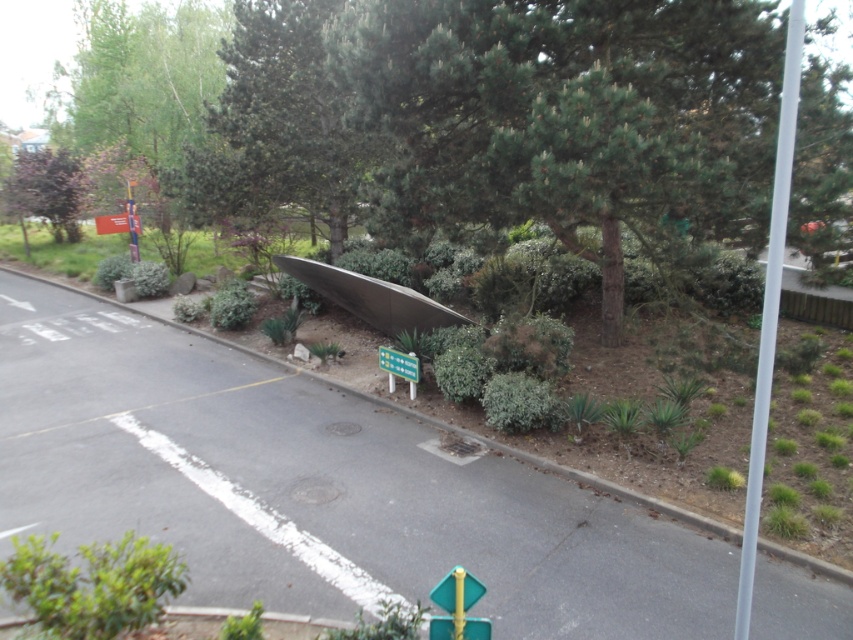
You are a city planner reviewing this street scene. The green textured tree at upper center is part of a proposed landscaping plan. Based on its position at coordinates point 0.195, 0.327, would it be positioned closer to the road or the center of the landscaped area?

The green textured tree at upper center is located at point [277,124], which places it closer to the road since it is positioned near the edge adjacent to the road in the landscaped area.

Looking at this image, you are a city planner reviewing the street layout. The green textured tree at upper center is crucial for shade. Can you confirm its exact coordinates to ensure it remains in the design plans?

The green textured tree at upper center is located at point (277, 124), so it should be included in the design plans at those coordinates.

You are a gardener planning to trim both the green textured tree at upper center and the green leafy bush at lower left. Based on their sizes, which one would require more time and effort?

The green textured tree at upper center requires more time and effort because it is larger in size than the green leafy bush at lower left.